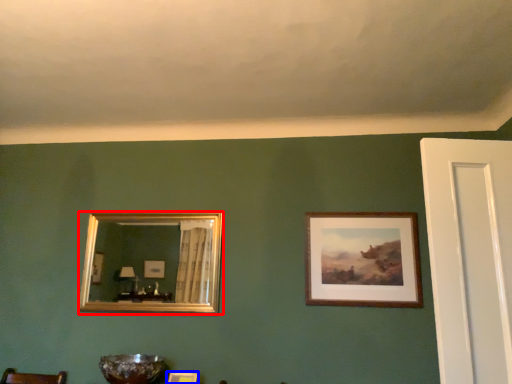
Question: Which point is further to the camera, picture frame (highlighted by a red box) or picture frame (highlighted by a blue box)?

Choices:
 (A) picture frame
 (B) picture frame

Answer: (A)